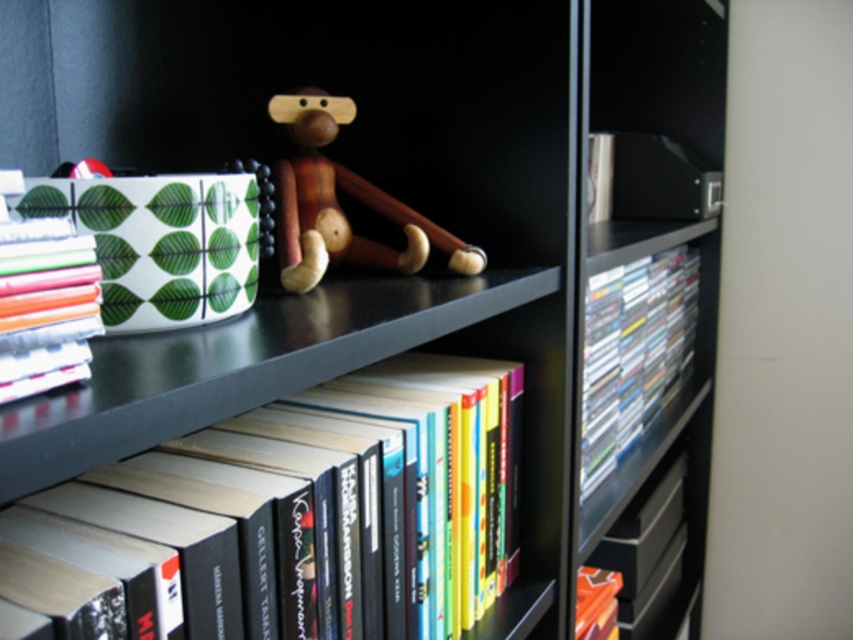
Looking at this image, does hardcover books at center have a smaller size compared to orange matte book at lower right?

No, hardcover books at center is not smaller than orange matte book at lower right.

Which is below, hardcover books at center or orange matte book at lower right?

orange matte book at lower right

Is point (440, 548) positioned behind point (610, 630)?

No, (440, 548) is in front of (610, 630).

Where is `hardcover books at center`? The image size is (853, 640). hardcover books at center is located at coordinates (300, 516).

Is point (486, 360) in front of point (662, 360)?

Yes, point (486, 360) is closer to viewer.

Can you confirm if hardcover books at center is wider than clear plastic dvds at right?

No, hardcover books at center is not wider than clear plastic dvds at right.

Who is more distant from viewer, (332, 401) or (628, 284)?

Point (628, 284)

I want to click on hardcover books at center, so click(300, 516).

Which is behind, point (589, 476) or point (309, 241)?

The point (589, 476) is more distant.

Is clear plastic dvds at right smaller than wooden monkey at center?

No.

Is point (677, 268) positioned behind point (408, 241)?

That is True.

Identify the location of clear plastic dvds at right. (633, 353).